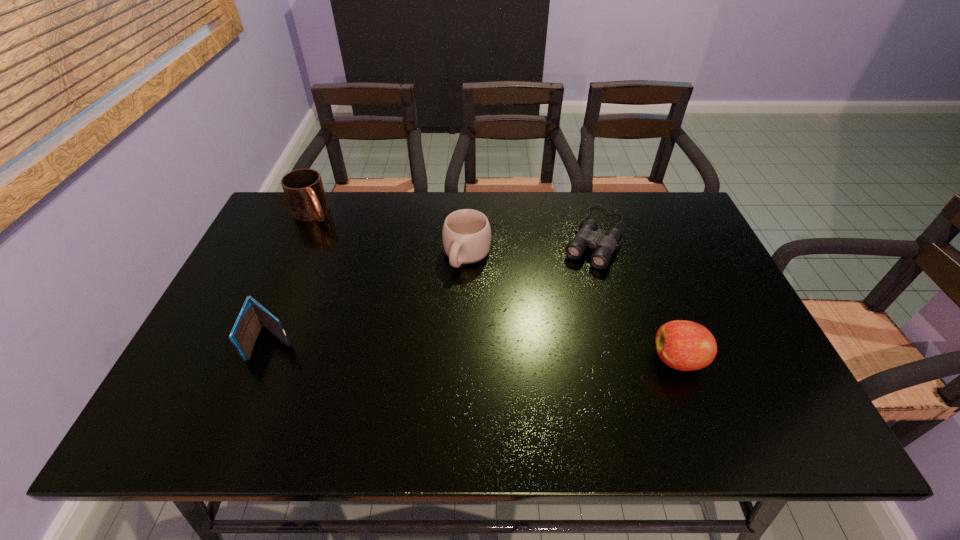
This screenshot has height=540, width=960. Identify the location of free space that satisfies the following two spatial constraints: 1. on the exterior surface of the apple; 2. on the left side of the wallet. (266, 360).

The height and width of the screenshot is (540, 960). Identify the location of vacant space that satisfies the following two spatial constraints: 1. on the front side of the binoculars; 2. on the left side of the left mug. pyautogui.click(x=301, y=237).